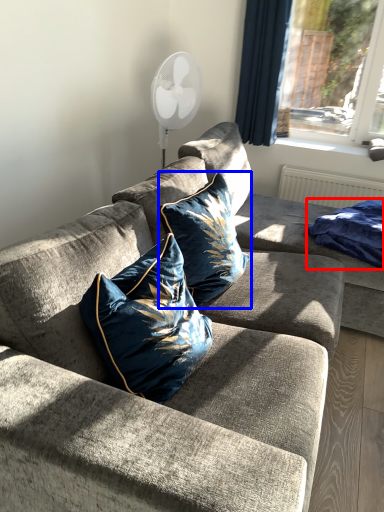
Question: Which object is further to the camera taking this photo, material (highlighted by a red box) or pillow (highlighted by a blue box)?

Choices:
 (A) material
 (B) pillow

Answer: (A)